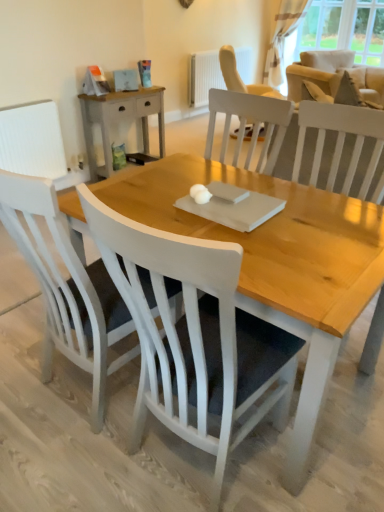
Locate an element on the screen. This screenshot has width=384, height=512. vacant space to the right of white wood chair at center, which ranks as the first chair in front-to-back order is located at coordinates click(x=327, y=455).